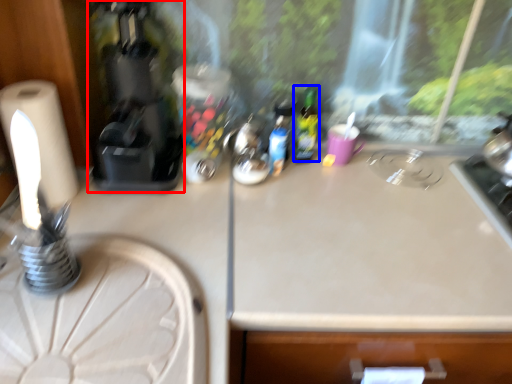
Question: Which object appears closest to the camera in this image, coffee machine (highlighted by a red box) or bottle (highlighted by a blue box)?

Choices:
 (A) coffee machine
 (B) bottle

Answer: (A)